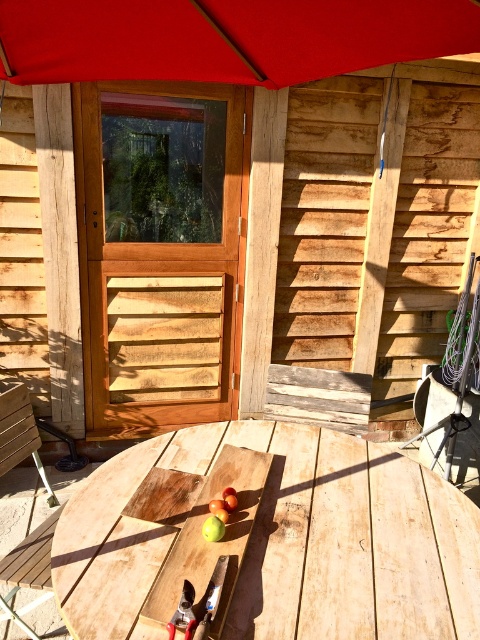
Question: Is wooden at center below red fabric umbrella at upper center?

Choices:
 (A) no
 (B) yes

Answer: (B)

Question: Which of the following is the farthest from the observer?

Choices:
 (A) (25, 451)
 (B) (466, 512)
 (C) (405, 1)
 (D) (282, 276)

Answer: (D)

Question: Can you confirm if wooden at center is positioned to the right of red fabric umbrella at upper center?

Choices:
 (A) yes
 (B) no

Answer: (A)

Question: Which point is closer to the camera?

Choices:
 (A) (264, 33)
 (B) (319, 188)
 (C) (36, 445)
 (D) (307, 605)

Answer: (D)

Question: Estimate the real-world distances between objects in this image. Which object is farther from the wooden at center?

Choices:
 (A) wooden bench at lower left
 (B) wooden door at center
 (C) red fabric umbrella at upper center

Answer: (B)

Question: Does wooden at center have a greater width compared to wooden bench at lower left?

Choices:
 (A) no
 (B) yes

Answer: (B)